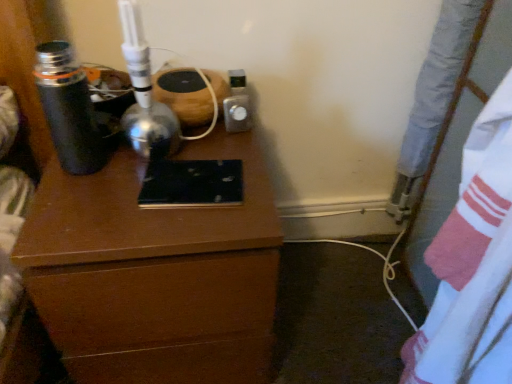
Question: Is metallic silver thermos at left positioned far away from white cotton sheet at right?

Choices:
 (A) no
 (B) yes

Answer: (A)

Question: From a real-world perspective, is metallic silver thermos at left over white cotton sheet at right?

Choices:
 (A) yes
 (B) no

Answer: (A)

Question: Does metallic silver thermos at left lie in front of white cotton sheet at right?

Choices:
 (A) yes
 (B) no

Answer: (B)

Question: Are metallic silver thermos at left and white cotton sheet at right making contact?

Choices:
 (A) no
 (B) yes

Answer: (A)

Question: Is metallic silver thermos at left at the right side of white cotton sheet at right?

Choices:
 (A) yes
 (B) no

Answer: (B)

Question: Is metallic silver thermos at left to the left of white cotton sheet at right from the viewer's perspective?

Choices:
 (A) yes
 (B) no

Answer: (A)

Question: Can you confirm if brown wood chest of drawers at center is bigger than white cotton sheet at right?

Choices:
 (A) yes
 (B) no

Answer: (A)

Question: Is brown wood chest of drawers at center positioned far away from white cotton sheet at right?

Choices:
 (A) no
 (B) yes

Answer: (A)

Question: From the image's perspective, is brown wood chest of drawers at center over white cotton sheet at right?

Choices:
 (A) yes
 (B) no

Answer: (A)

Question: Considering the relative sizes of brown wood chest of drawers at center and white cotton sheet at right in the image provided, is brown wood chest of drawers at center wider than white cotton sheet at right?

Choices:
 (A) no
 (B) yes

Answer: (B)

Question: Does brown wood chest of drawers at center lie behind white cotton sheet at right?

Choices:
 (A) yes
 (B) no

Answer: (A)

Question: From a real-world perspective, does brown wood chest of drawers at center stand above white cotton sheet at right?

Choices:
 (A) no
 (B) yes

Answer: (A)

Question: Is white cotton sheet at right looking in the opposite direction of metallic silver thermos at left?

Choices:
 (A) yes
 (B) no

Answer: (B)